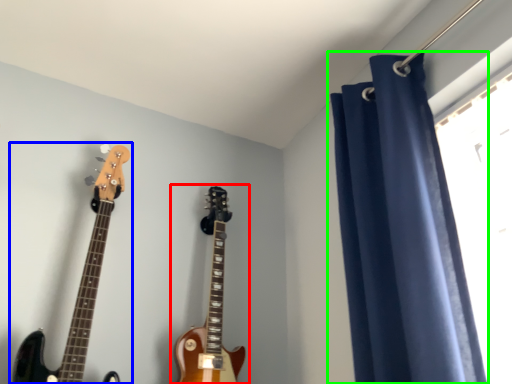
Question: Which object is positioned closest to guitar (highlighted by a red box)? Select from guitar (highlighted by a blue box) and curtain (highlighted by a green box).

Choices:
 (A) guitar
 (B) curtain

Answer: (A)